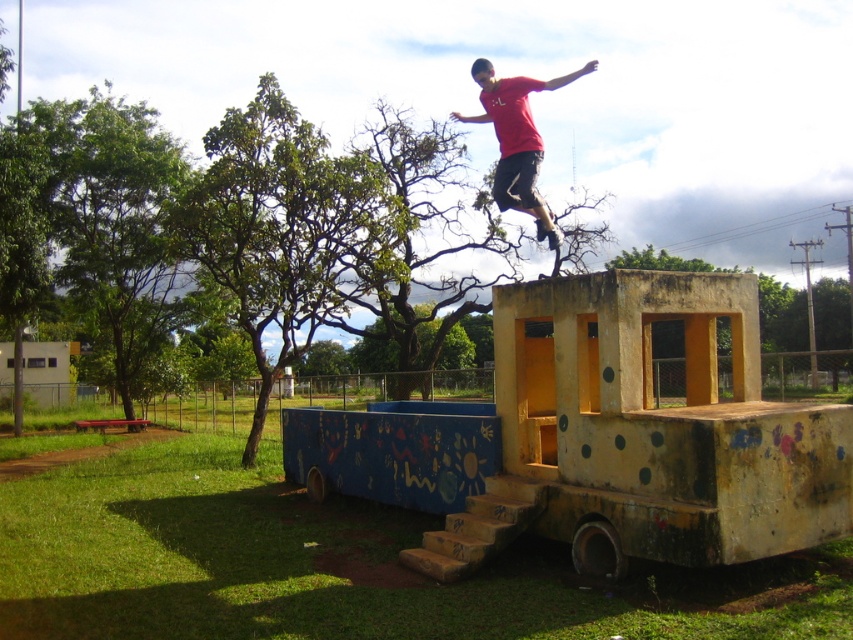
Consider the image. You are a photographer trying to capture the red matte shirt at upper center and the painted wood obstacle at center in a single shot. Based on their positions, which object is closer to the camera?

The painted wood obstacle at center is located below the red matte shirt at upper center, meaning the red matte shirt at upper center is closer to the camera.

You are a photographer trying to capture the entire scene in one shot. The painted wood obstacle at center and the red matte shirt at upper center are both in your viewfinder. Since you want to ensure both are clearly visible, which object should you focus on first considering their sizes?

The painted wood obstacle at center has a smaller size compared to the red matte shirt at upper center, so you should focus on the painted wood obstacle at center first to ensure its details are sharp while the larger red matte shirt at upper center will remain in focus more easily due to its size.